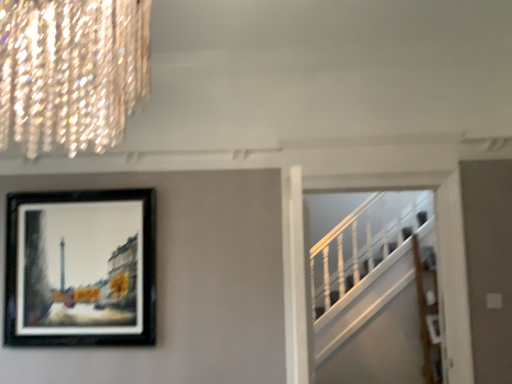
Question: Is black matte picture frame at upper left oriented away from crystal glass chandelier at upper left?

Choices:
 (A) no
 (B) yes

Answer: (A)

Question: Is black matte picture frame at upper left beside crystal glass chandelier at upper left?

Choices:
 (A) no
 (B) yes

Answer: (A)

Question: Would you say crystal glass chandelier at upper left is part of black matte picture frame at upper left's contents?

Choices:
 (A) yes
 (B) no

Answer: (B)

Question: Is black matte picture frame at upper left shorter than crystal glass chandelier at upper left?

Choices:
 (A) yes
 (B) no

Answer: (B)

Question: From a real-world perspective, is black matte picture frame at upper left positioned over crystal glass chandelier at upper left based on gravity?

Choices:
 (A) yes
 (B) no

Answer: (B)

Question: Is black matte picture frame at upper left situated inside crystal glass chandelier at upper left or outside?

Choices:
 (A) outside
 (B) inside

Answer: (A)

Question: In terms of size, does black matte picture frame at upper left appear bigger or smaller than crystal glass chandelier at upper left?

Choices:
 (A) small
 (B) big

Answer: (A)

Question: From the image's perspective, relative to crystal glass chandelier at upper left, is black matte picture frame at upper left above or below?

Choices:
 (A) above
 (B) below

Answer: (B)

Question: Is point (8, 198) positioned closer to the camera than point (74, 89)?

Choices:
 (A) farther
 (B) closer

Answer: (A)

Question: Considering the positions of crystal glass chandelier at upper left and white wooden stairs at right in the image, is crystal glass chandelier at upper left wider or thinner than white wooden stairs at right?

Choices:
 (A) wide
 (B) thin

Answer: (A)

Question: Is point [x=22, y=0] positioned closer to the camera than point [x=335, y=354]?

Choices:
 (A) closer
 (B) farther

Answer: (A)

Question: From a real-world perspective, relative to white wooden stairs at right, is crystal glass chandelier at upper left vertically above or below?

Choices:
 (A) above
 (B) below

Answer: (A)

Question: Considering the positions of crystal glass chandelier at upper left and white wooden stairs at right in the image, is crystal glass chandelier at upper left taller or shorter than white wooden stairs at right?

Choices:
 (A) short
 (B) tall

Answer: (A)

Question: Would you say white wooden stairs at right is inside or outside crystal glass chandelier at upper left?

Choices:
 (A) inside
 (B) outside

Answer: (B)

Question: Considering the positions of white wooden stairs at right and crystal glass chandelier at upper left in the image, is white wooden stairs at right bigger or smaller than crystal glass chandelier at upper left?

Choices:
 (A) big
 (B) small

Answer: (B)